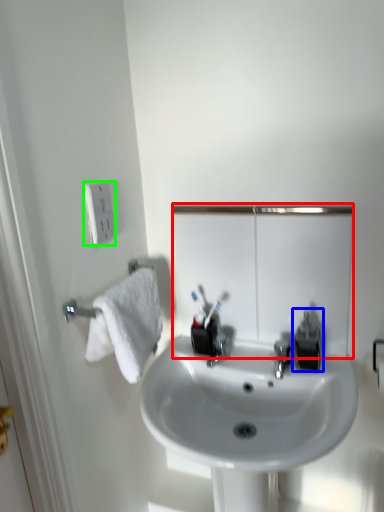
Question: Which object is positioned farthest from mirror (highlighted by a red box)? Select from plumbing fixture (highlighted by a blue box) and electric outlet (highlighted by a green box).

Choices:
 (A) plumbing fixture
 (B) electric outlet

Answer: (B)